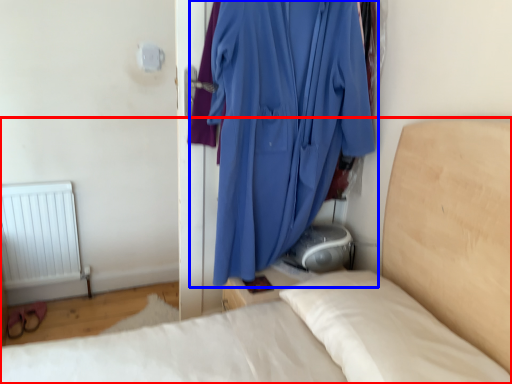
Question: Among these objects, which one is nearest to the camera, bed (highlighted by a red box) or curtain (highlighted by a blue box)?

Choices:
 (A) bed
 (B) curtain

Answer: (A)